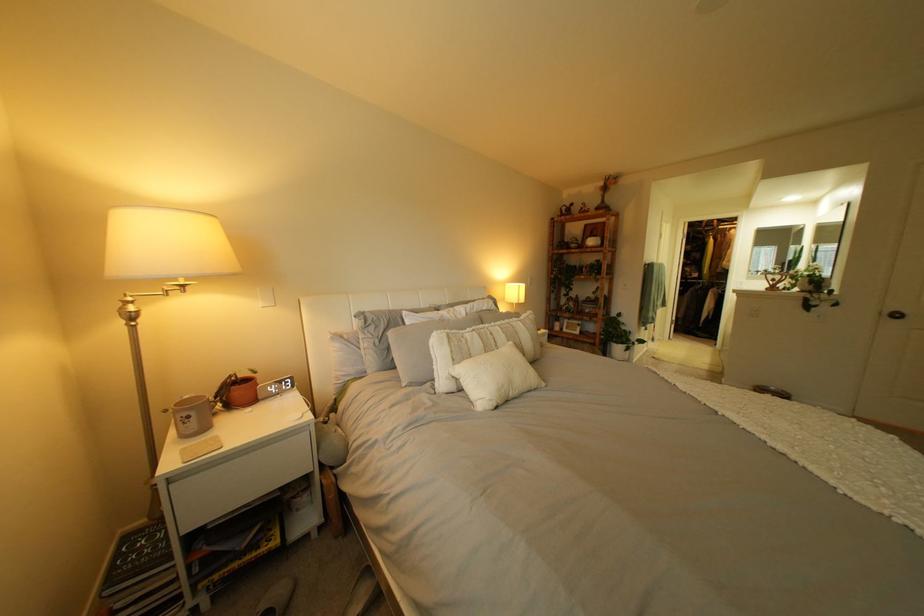
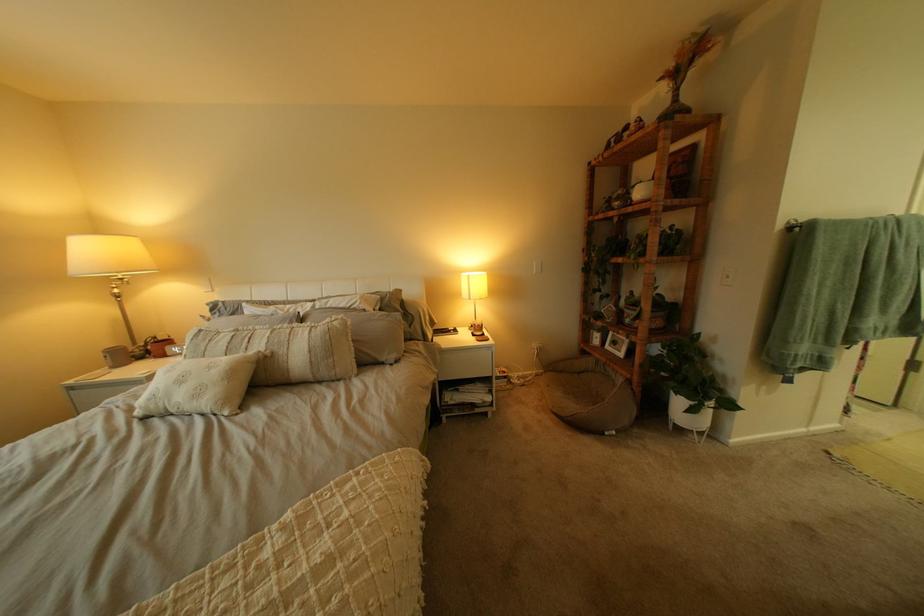
Where in the second image is the point corresponding to (x=580, y=331) from the first image?

(623, 347)